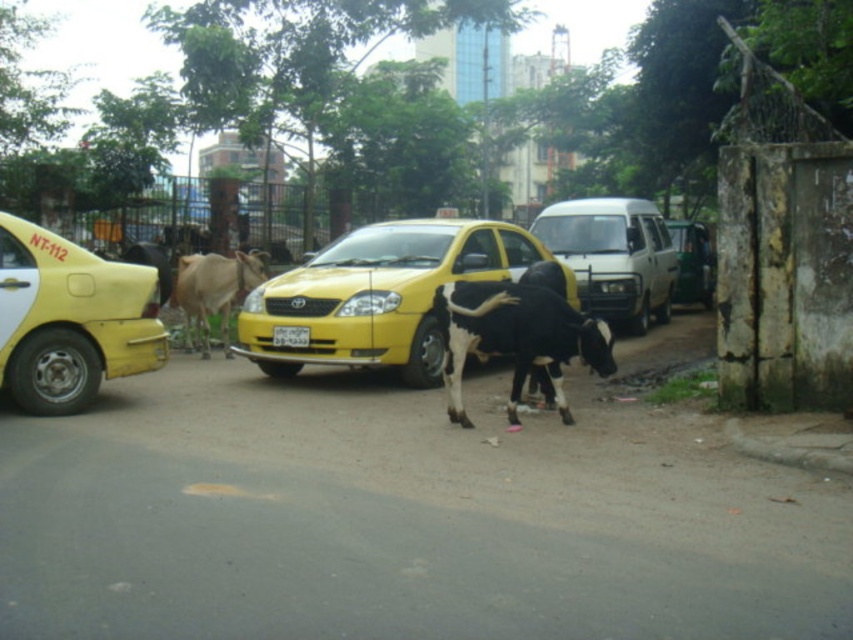
You are a delivery driver who needs to pick up a package from the yellow matte taxi at center. The pickup location is marked by the point at coordinates (379,294). Can you confirm if the point is on the yellow matte taxi at center?

Yes, the point at coordinates (379,294) marks the yellow matte taxi at center, so it is located on the taxi.

You are standing at the point with coordinates point (704, 272) and want to walk to the point with coordinates point (219, 288). Is there a clear path between these two points without needing to go around any obstacles?

Yes, there is a clear path between point (704, 272) and point (219, 288) because point (219, 288) is in front of point (704, 272), so you can walk directly towards it without obstacles.

You are a pedestrian trying to cross the street safely. You see the yellow matte taxi at center and the metallic silver van at center. Which vehicle is closer to you?

The yellow matte taxi at center is closer to you because it is positioned under the metallic silver van at center, indicating it is in front.